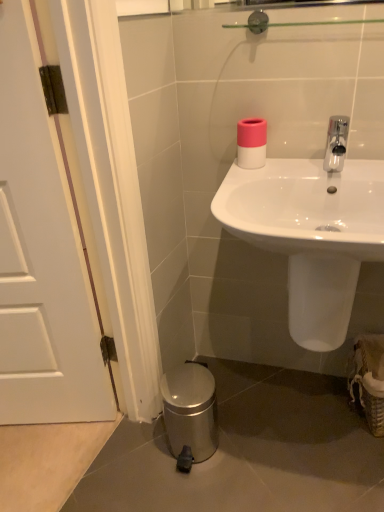
Identify the location of vacant space underneath white matte door at left (from a real-world perspective). (120, 458).